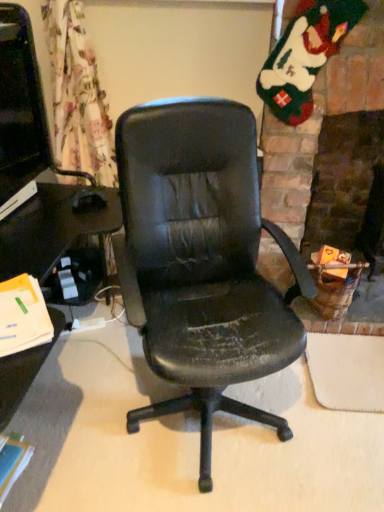
Question: Is point (16, 176) positioned closer to the camera than point (301, 70)?

Choices:
 (A) closer
 (B) farther

Answer: (B)

Question: From the image's perspective, is matte black monitor at left above or below fuzzy felt stocking at upper right?

Choices:
 (A) below
 (B) above

Answer: (A)

Question: From a real-world perspective, is matte black monitor at left positioned above or below fuzzy felt stocking at upper right?

Choices:
 (A) below
 (B) above

Answer: (A)

Question: Is point (299, 76) closer or farther from the camera than point (0, 12)?

Choices:
 (A) closer
 (B) farther

Answer: (B)

Question: From a real-world perspective, is fuzzy felt stocking at upper right positioned above or below matte black monitor at left?

Choices:
 (A) below
 (B) above

Answer: (B)

Question: Relative to matte black monitor at left, is fuzzy felt stocking at upper right in front or behind?

Choices:
 (A) behind
 (B) front

Answer: (A)

Question: Is fuzzy felt stocking at upper right taller or shorter than matte black monitor at left?

Choices:
 (A) short
 (B) tall

Answer: (B)